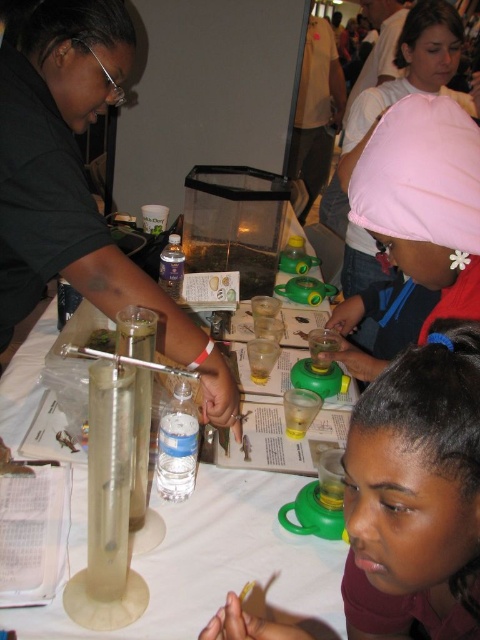
You are a participant at the science fair and need to place the pink fabric cap at upper center onto the matte green plastic cup at center. Can you do this without moving any other items on the table?

Yes, because the matte green plastic cup at center is to the left of the pink fabric cap at upper center, so you can reach the cup first and slide the cap onto it without disturbing other items.

Please provide the 2D coordinates of the matte green plastic cup at center in the image.

The 2D coordinates of the matte green plastic cup at center are at point (416, 493).

You are at the science fair and see two points marked on the table. The first point is at coordinate point(81, 493) and the second is at point(444, 289). If you are facing the table, which point is closer to you?

Point(444, 289) is closer to you because it is in front of point(81, 493).